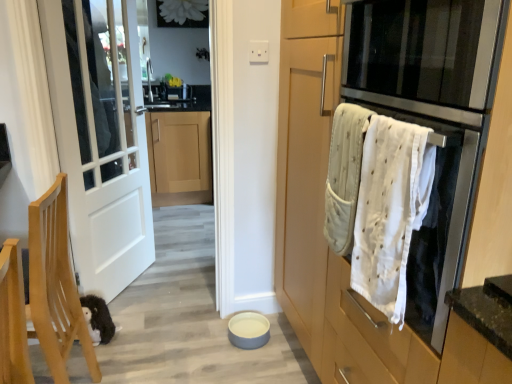
Question: Is light wood cabinet at center, arranged as the first cabinetry when viewed from the left, inside the boundaries of matte wood cabinet at right, which is the 1th cabinetry from right to left, or outside?

Choices:
 (A) inside
 (B) outside

Answer: (B)

Question: In the image, is light wood cabinet at center, arranged as the second cabinetry when viewed from the right, on the left side or the right side of matte wood cabinet at right, which is the 1th cabinetry from right to left?

Choices:
 (A) right
 (B) left

Answer: (B)

Question: Estimate the real-world distances between objects in this image. Which object is closer to the light wood cabinet at center, which is the first cabinetry in back-to-front order?

Choices:
 (A) wooden chair at lower left
 (B) stainless steel oven at right, marked as the second oven in a top-to-bottom arrangement
 (C) white glossy sink at upper center
 (D) white textured towel at right
 (E) stainless steel oven at right, which is the 2th oven in bottom-to-top order

Answer: (C)

Question: Based on their relative distances, which object is farther from the wooden chair at lower left?

Choices:
 (A) light wood cabinet at center, placed as the 2th cabinetry when sorted from front to back
 (B) matte wood cabinet at right, which is the 1th cabinetry from right to left
 (C) matte gray bowl at center
 (D) white textured towel at right
 (E) stainless steel oven at right, which is the 2th oven in bottom-to-top order

Answer: (A)